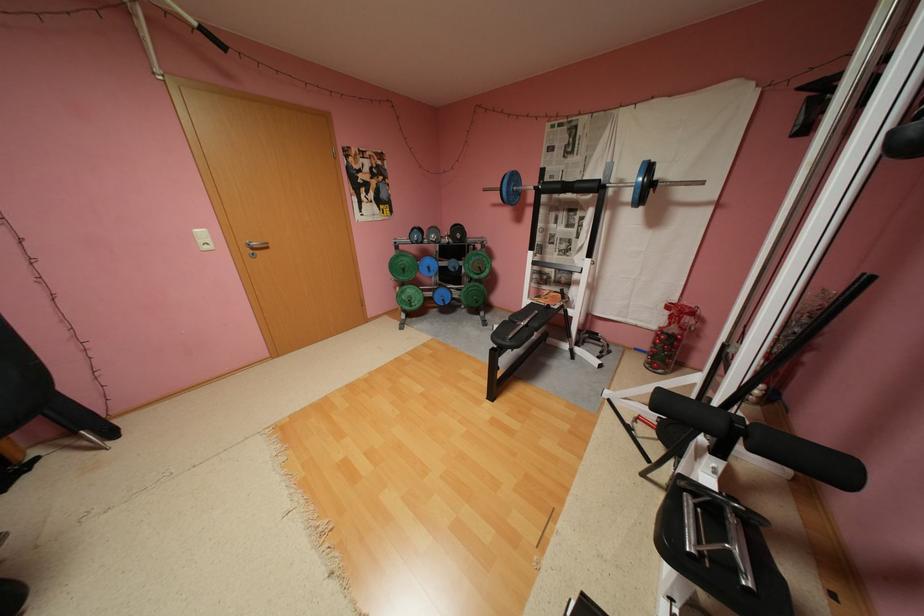
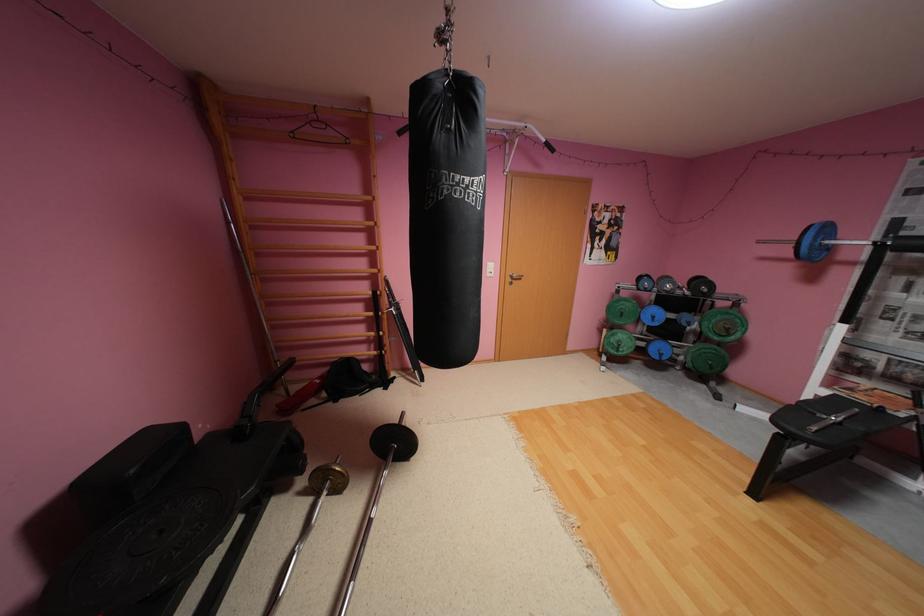
Where in the second image is the point corresponding to pixel 523 177 from the first image?

(835, 229)